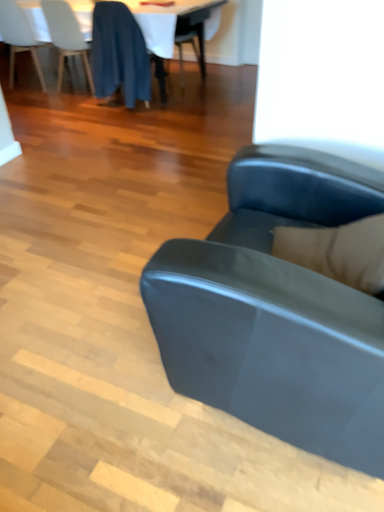
Question: Is white fabric table at upper center to the left or to the right of matte black couch at center in the image?

Choices:
 (A) right
 (B) left

Answer: (B)

Question: From a real-world perspective, is white fabric table at upper center physically located above or below matte black couch at center?

Choices:
 (A) below
 (B) above

Answer: (A)

Question: Which object is the farthest from the matte black couch at center?

Choices:
 (A) white glossy table at upper center
 (B) white matte chair at upper left, the 1th chair in the left-to-right sequence
 (C) blue fabric chair at upper left, arranged as the second chair when viewed from the right
 (D) dark blue fabric at upper left, placed as the third chair when sorted from left to right
 (E) white fabric table at upper center

Answer: (B)

Question: Considering the real-world distances, which object is closest to the white fabric table at upper center?

Choices:
 (A) dark blue fabric at upper left, which is the 1th chair in right-to-left order
 (B) white glossy table at upper center
 (C) blue fabric chair at upper left, arranged as the second chair when viewed from the right
 (D) white matte chair at upper left, the 1th chair in the left-to-right sequence
 (E) matte black couch at center

Answer: (A)